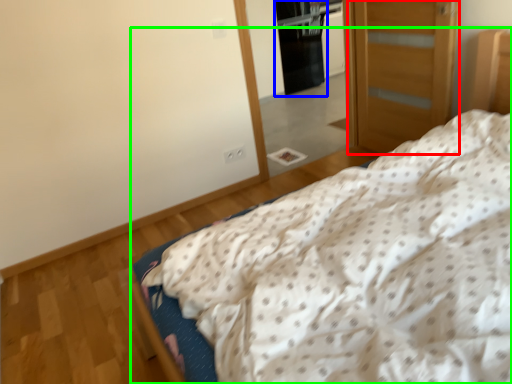
Question: Which is nearer to the door (highlighted by a red box)? screen door (highlighted by a blue box) or bed (highlighted by a green box).

Choices:
 (A) screen door
 (B) bed

Answer: (B)